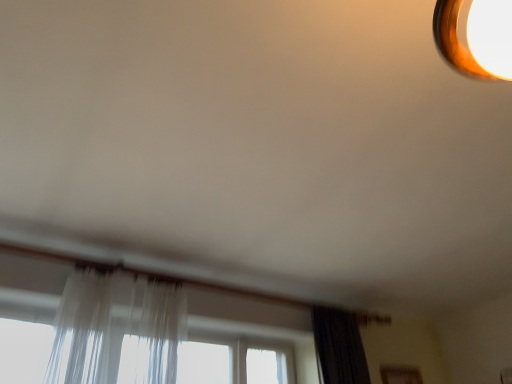
In order to click on transparent fabric at lower center in this screenshot , I will do `click(253, 321)`.

What do you see at coordinates (253, 321) in the screenshot?
I see `transparent fabric at lower center` at bounding box center [253, 321].

Measure the distance between point (19,256) and camera.

The distance of point (19,256) from camera is 7.05 feet.

Where is `transparent fabric at lower center`? transparent fabric at lower center is located at coordinates (253, 321).